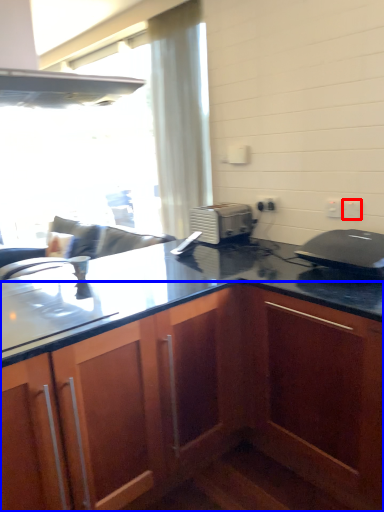
Question: Which object is closer to the camera taking this photo, electric outlet (highlighted by a red box) or cabinetry (highlighted by a blue box)?

Choices:
 (A) electric outlet
 (B) cabinetry

Answer: (B)